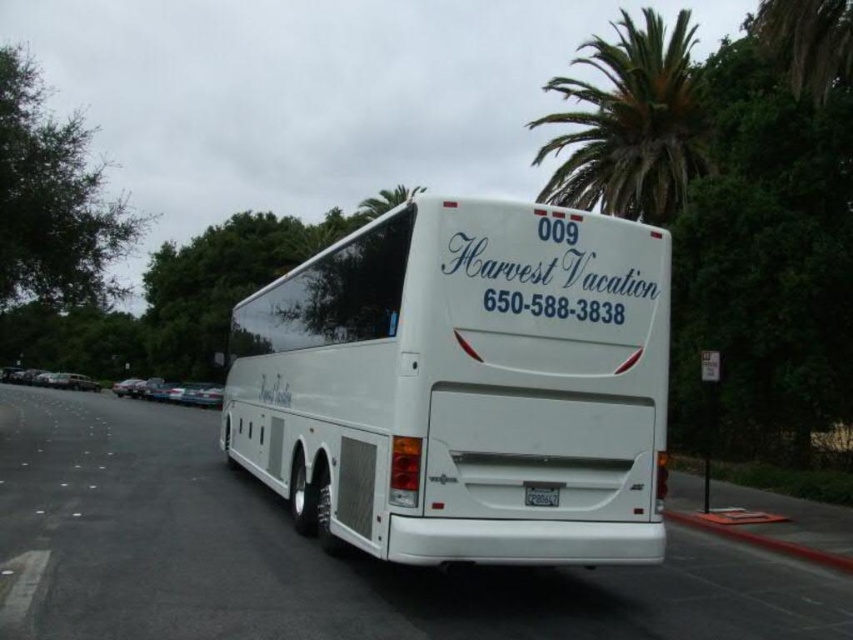
Question: Which of the following is the closest to the observer?

Choices:
 (A) click(x=556, y=486)
 (B) click(x=386, y=209)
 (C) click(x=498, y=506)
 (D) click(x=666, y=513)

Answer: (C)

Question: Among these points, which one is nearest to the camera?

Choices:
 (A) (660, 97)
 (B) (706, 525)
 (C) (376, 192)

Answer: (B)

Question: Does white glossy bus at center appear under black plastic license plate at center?

Choices:
 (A) no
 (B) yes

Answer: (A)

Question: Is white glossy bus at center above black plastic license plate at center?

Choices:
 (A) no
 (B) yes

Answer: (B)

Question: Which point appears closest to the camera in this image?

Choices:
 (A) (596, 170)
 (B) (670, 512)
 (C) (392, 196)

Answer: (B)

Question: Is green leafy palm tree at upper right thinner than red rubber curb at lower right?

Choices:
 (A) yes
 (B) no

Answer: (B)